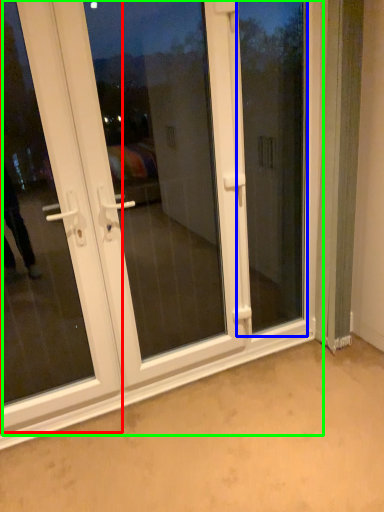
Question: Which object is the farthest from door (highlighted by a red box)? Choose among these: window screen (highlighted by a blue box) or door (highlighted by a green box).

Choices:
 (A) window screen
 (B) door

Answer: (A)